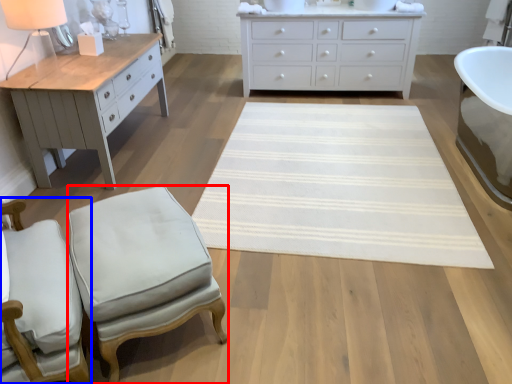
Question: Which object appears closest to the camera in this image, stool (highlighted by a red box) or chair (highlighted by a blue box)?

Choices:
 (A) stool
 (B) chair

Answer: (B)